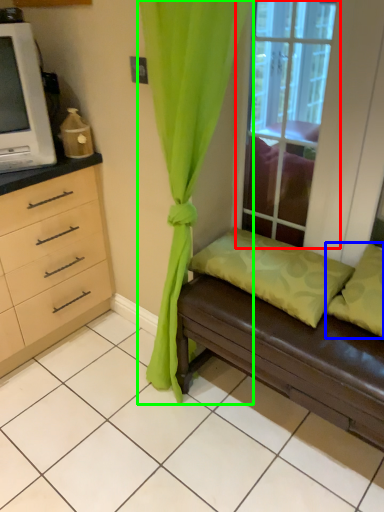
Question: Based on their relative distances, which object is farther from window (highlighted by a red box)? Choose from pillow (highlighted by a blue box) and curtain (highlighted by a green box).

Choices:
 (A) pillow
 (B) curtain

Answer: (B)